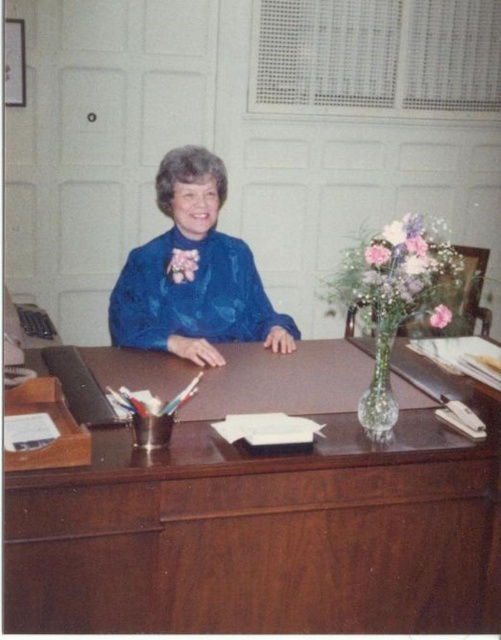
You are organizing a small event and need to place a 12 inch wide decorative plate on the desk. The plate must be placed either on the brown wood table at center or the translucent glass vase at center. Based on their sizes, which object can accommodate the plate without it overhanging?

The brown wood table at center has a larger width than the translucent glass vase at center, so the plate can be placed on the brown wood table at center without overhanging.

You are a tailor measuring the distance between the blue satin blouse at center and the pink silk flower at center for a client. The client requires the items to be at least 6 inches apart. Can you confirm if the current placement meets the requirement?

The blue satin blouse at center is 7.02 inches from the pink silk flower at center, which exceeds the required 6 inches, so the current placement meets the client requirement.